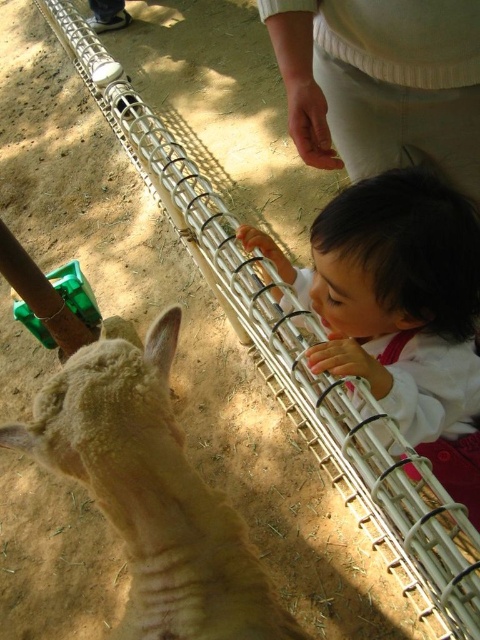
Question: Is the position of fuzzy woolen sheep at center less distant than that of smooth white shirt at center?

Choices:
 (A) no
 (B) yes

Answer: (B)

Question: Which object appears farthest from the camera in this image?

Choices:
 (A) fuzzy woolen sheep at center
 (B) smooth white shirt at center

Answer: (B)

Question: Does fuzzy woolen sheep at center appear under smooth white shirt at center?

Choices:
 (A) yes
 (B) no

Answer: (A)

Question: Can you confirm if fuzzy woolen sheep at center is positioned above smooth white shirt at center?

Choices:
 (A) no
 (B) yes

Answer: (A)